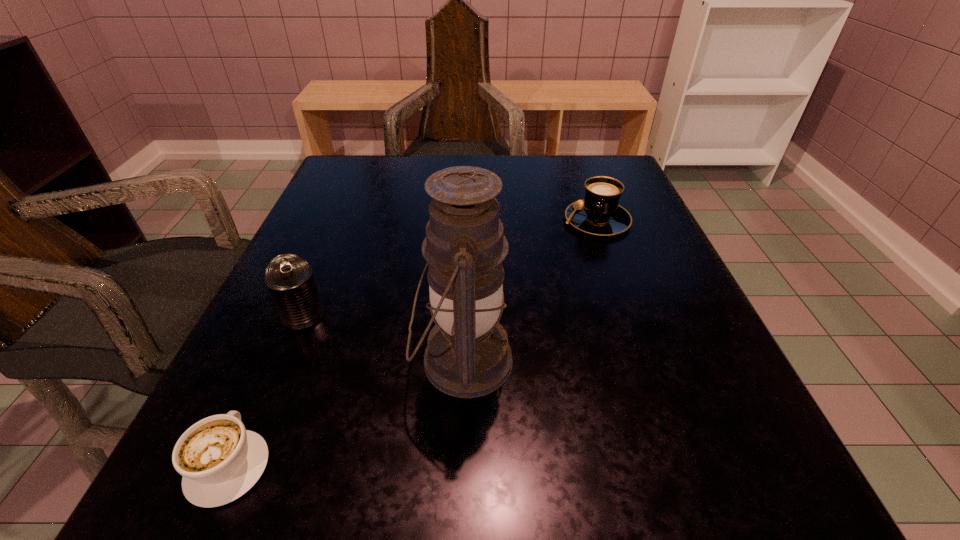
Find the location of a particular element. This screenshot has width=960, height=540. the tallest object is located at coordinates (467, 355).

At what (x,y) coordinates should I click in order to perform the action: click on the second object from right to left. Please return your answer as a coordinate pair (x, y). The width and height of the screenshot is (960, 540). Looking at the image, I should click on (467, 355).

This screenshot has height=540, width=960. I want to click on the second tallest object, so tap(289, 278).

This screenshot has height=540, width=960. I want to click on the farthest object, so click(599, 213).

The image size is (960, 540). Identify the location of the farther cappuccino. point(599,213).

You are a GUI agent. You are given a task and a screenshot of the screen. Output one action in this format:
    pyautogui.click(x=<x>, y=<y>)
    Task: Click on the nearest object
    The height and width of the screenshot is (540, 960).
    Given the screenshot: What is the action you would take?
    pyautogui.click(x=220, y=460)

Image resolution: width=960 pixels, height=540 pixels. What are the coordinates of `the shortest object` in the screenshot? It's located at (220, 460).

Locate an element on the screen. The width and height of the screenshot is (960, 540). blank space located 0.240m on the right of the third object from left to right is located at coordinates (677, 361).

The image size is (960, 540). In order to click on free spot located on the back of the can in this screenshot , I will do `click(357, 187)`.

What are the coordinates of `vacant space situated on the left of the rightmost object` in the screenshot? It's located at (472, 220).